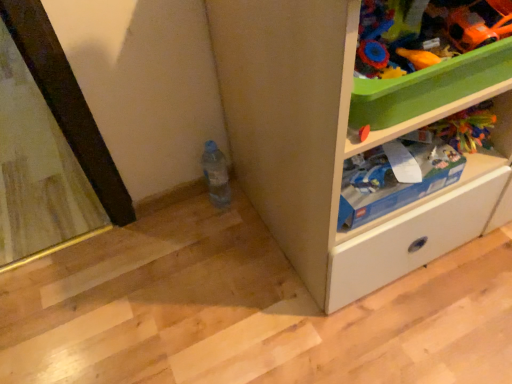
Question: Considering the positions of orange plastic spoon at upper right, the first toy from the left, and orange matte car at upper right, which appears as the first toy when viewed from the right, in the image, is orange plastic spoon at upper right, the first toy from the left, taller or shorter than orange matte car at upper right, which appears as the first toy when viewed from the right,?

Choices:
 (A) short
 (B) tall

Answer: (A)

Question: From the image's perspective, is orange plastic spoon at upper right, the 2th toy positioned from the right, above or below orange matte car at upper right, which is the second toy in left-to-right order?

Choices:
 (A) above
 (B) below

Answer: (B)

Question: Which object is the closest to the orange plastic spoon at upper right, the 2th toy positioned from the right?

Choices:
 (A) translucent plastic bottle at lower center
 (B) blue cardboard box at upper right
 (C) white matte cabinet at lower right
 (D) orange matte car at upper right, which is the second toy in left-to-right order

Answer: (D)

Question: Which of these objects is positioned closest to the translucent plastic bottle at lower center?

Choices:
 (A) blue cardboard box at upper right
 (B) white matte cabinet at lower right
 (C) orange plastic spoon at upper right, the first toy from the left
 (D) orange matte car at upper right, which is the second toy in left-to-right order

Answer: (B)